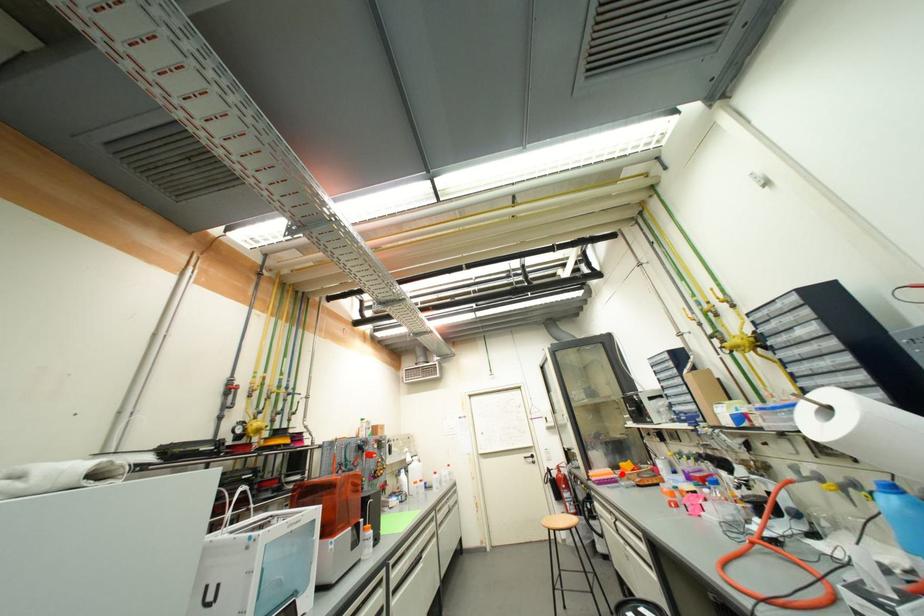
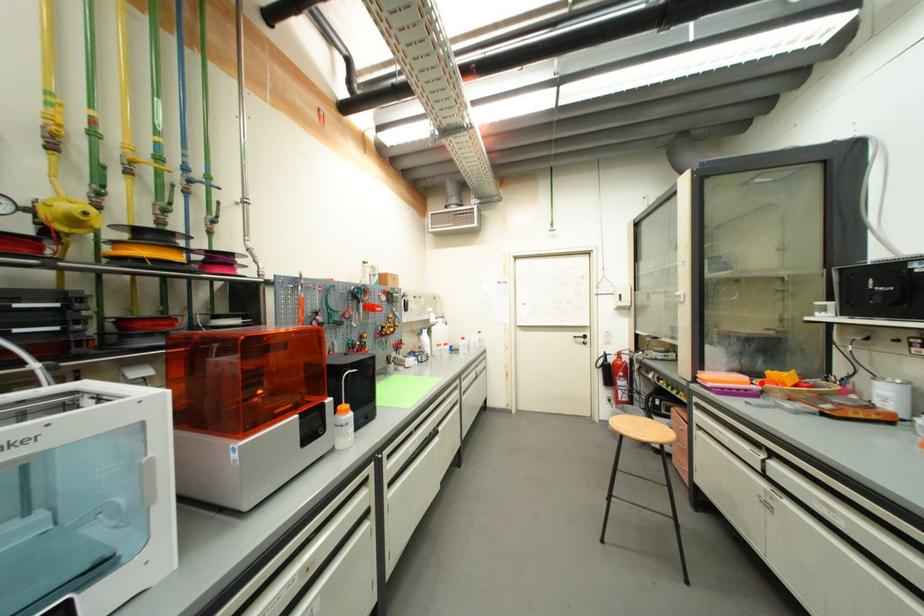
I am providing you with two images of the same scene from different viewpoints. A red point is marked on the first image and another point is marked on the second image. Do the highlighted points in image1 and image2 indicate the same real-world spot?

Yes